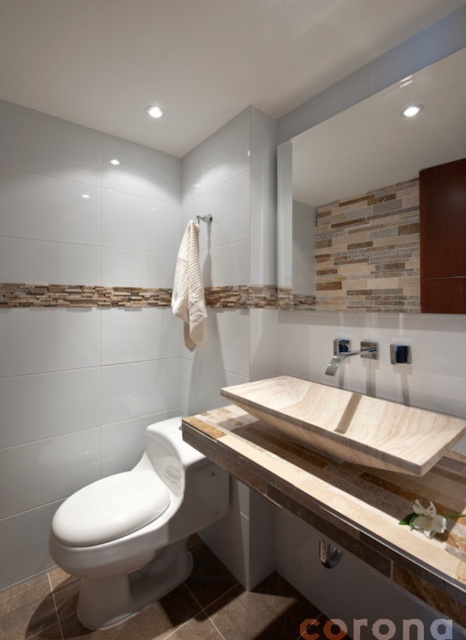
You are designing a bathroom layout and need to ensure proper placement of the wooden frame mirror at upper center and the white ceramic shower at upper center. Based on their positions in the image, which object is situated lower in the bathroom?

The wooden frame mirror at upper center is located below the white ceramic shower at upper center, so it is situated lower in the bathroom.

You are standing in the bathroom and want to locate the wooden frame mirror at upper center. According to the bathroom layout, where should you look?

The wooden frame mirror at upper center is located at the 2D coordinates point (365, 193).